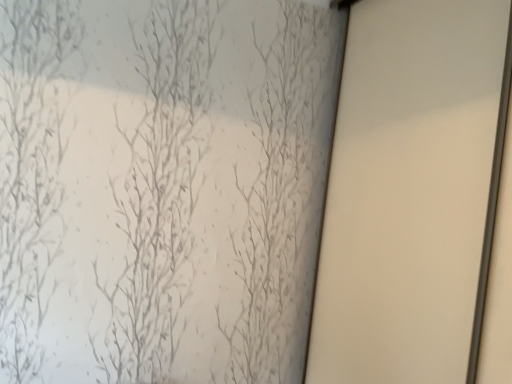
Find the location of a particular element. white matte door at right is located at coordinates (408, 191).

Image resolution: width=512 pixels, height=384 pixels. Describe the element at coordinates (408, 191) in the screenshot. I see `white matte door at right` at that location.

Image resolution: width=512 pixels, height=384 pixels. Identify the location of white matte door at right. (408, 191).